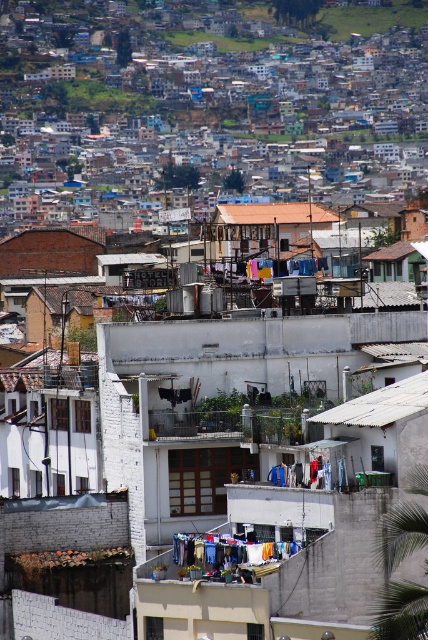
You are a drone operator tasked with delivering a package to a building in this urban area. You notice two roofs in the center of the image, a white corrugated metal roof at center and a brown tile roof at center. Your drone has a maximum flight range of 80 meters. Can your drone safely travel between these two roofs without exceeding its range?

The distance between the white corrugated metal roof at center and the brown tile roof at center is 78.57 meters, which is within the drone operator s 80 meter range. Therefore, the drone can safely travel between these two roofs without exceeding its range.

You are a delivery person trying to navigate through the narrow alleys of this densely packed urban area. You need to locate a building with a white corrugated metal roof at center and a brown tile roof at center. Which roof is positioned to the right of the other?

The white corrugated metal roof at center is positioned on the right side of brown tile roof at center, so the white one is to the right of the brown one.

Based on the photo, you are a delivery person trying to navigate through the narrow alleys of this urban area. You see the white corrugated metal roof at center and the blue fabric laundry at center. Which object is located above the other?

The white corrugated metal roof at center is positioned over blue fabric laundry at center, so the roof is above the laundry.